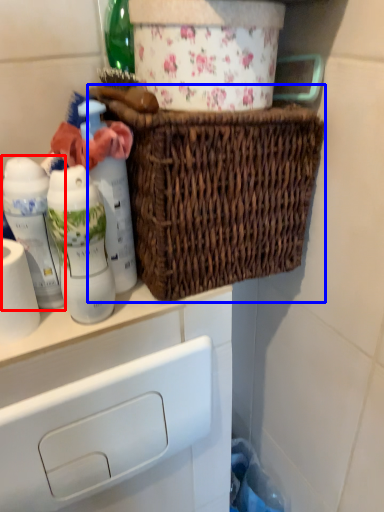
Question: Which object appears farthest to the camera in this image, bottle (highlighted by a red box) or picnic basket (highlighted by a blue box)?

Choices:
 (A) bottle
 (B) picnic basket

Answer: (A)